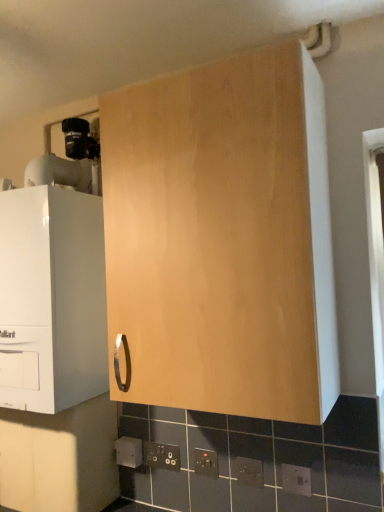
Question: Is light wood cabinet at center, acting as the 3th cabinetry starting from the left, to the right of matte wood cabinet at lower left, which is counted as the 2th cabinetry, starting from the left, from the viewer's perspective?

Choices:
 (A) no
 (B) yes

Answer: (B)

Question: Considering the relative positions of light wood cabinet at center, acting as the 3th cabinetry starting from the left, and matte wood cabinet at lower left, which is counted as the 2th cabinetry, starting from the left, in the image provided, is light wood cabinet at center, acting as the 3th cabinetry starting from the left, to the left of matte wood cabinet at lower left, which is counted as the 2th cabinetry, starting from the left, from the viewer's perspective?

Choices:
 (A) yes
 (B) no

Answer: (B)

Question: Is the depth of light wood cabinet at center, acting as the 3th cabinetry starting from the left, less than that of matte wood cabinet at lower left, which is counted as the 2th cabinetry, starting from the left?

Choices:
 (A) no
 (B) yes

Answer: (B)

Question: From the image's perspective, is light wood cabinet at center, which is the 1th cabinetry in right-to-left order, beneath matte wood cabinet at lower left, positioned as the second cabinetry in right-to-left order?

Choices:
 (A) yes
 (B) no

Answer: (B)

Question: From the image's perspective, is light wood cabinet at center, acting as the 3th cabinetry starting from the left, on top of matte wood cabinet at lower left, positioned as the second cabinetry in right-to-left order?

Choices:
 (A) no
 (B) yes

Answer: (B)

Question: Is point (218, 65) closer or farther from the camera than point (306, 486)?

Choices:
 (A) closer
 (B) farther

Answer: (A)

Question: In terms of size, does light wood cabinet at center, which is the 1th cabinetry in right-to-left order, appear bigger or smaller than matte black electric outlet at lower center, arranged as the fifth electric outlet when viewed from the left?

Choices:
 (A) big
 (B) small

Answer: (A)

Question: Considering their positions, is light wood cabinet at center, acting as the 3th cabinetry starting from the left, located in front of or behind matte black electric outlet at lower center, the fifth electric outlet in the back-to-front sequence?

Choices:
 (A) front
 (B) behind

Answer: (A)

Question: From a real-world perspective, is light wood cabinet at center, acting as the 3th cabinetry starting from the left, physically located above or below matte black electric outlet at lower center, which ranks as the 1th electric outlet in front-to-back order?

Choices:
 (A) above
 (B) below

Answer: (A)

Question: Visually, is matte black socket at lower center, which is the 4th electric outlet from right to left, positioned to the left or to the right of matte black electric outlet at lower center, arranged as the fifth electric outlet when viewed from the left?

Choices:
 (A) right
 (B) left

Answer: (B)

Question: In terms of width, does matte black socket at lower center, the 4th electric outlet in the front-to-back sequence, look wider or thinner when compared to matte black electric outlet at lower center, which ranks as the 1th electric outlet in front-to-back order?

Choices:
 (A) thin
 (B) wide

Answer: (B)

Question: From the image's perspective, is matte black socket at lower center, the second electric outlet positioned from the left, positioned above or below matte black electric outlet at lower center, arranged as the fifth electric outlet when viewed from the left?

Choices:
 (A) below
 (B) above

Answer: (A)

Question: Is matte black socket at lower center, which is the 4th electric outlet from right to left, in front of or behind matte black electric outlet at lower center, which ranks as the 1th electric outlet in front-to-back order, in the image?

Choices:
 (A) front
 (B) behind

Answer: (B)

Question: From a real-world perspective, is matte black electric outlet at lower center, the fifth electric outlet in the back-to-front sequence, above or below matte wood cabinet at lower left, which is counted as the 2th cabinetry, starting from the left?

Choices:
 (A) above
 (B) below

Answer: (B)

Question: Is matte black electric outlet at lower center, arranged as the fifth electric outlet when viewed from the left, taller or shorter than matte wood cabinet at lower left, which is counted as the 2th cabinetry, starting from the left?

Choices:
 (A) short
 (B) tall

Answer: (A)